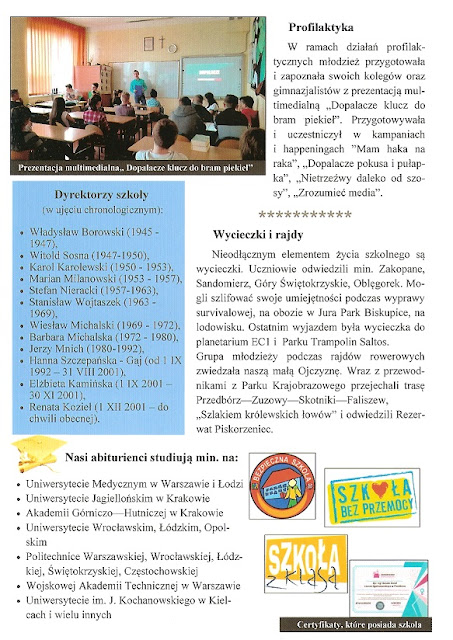
Where is `window`? The height and width of the screenshot is (640, 453). window is located at coordinates [59, 61].